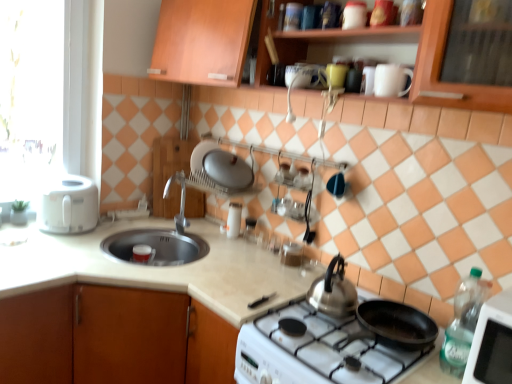
The width and height of the screenshot is (512, 384). What are the coordinates of `vacant space that is to the left of white glossy soap dispenser at upper center, placed as the first appliance when sorted from back to front` in the screenshot? It's located at (205, 228).